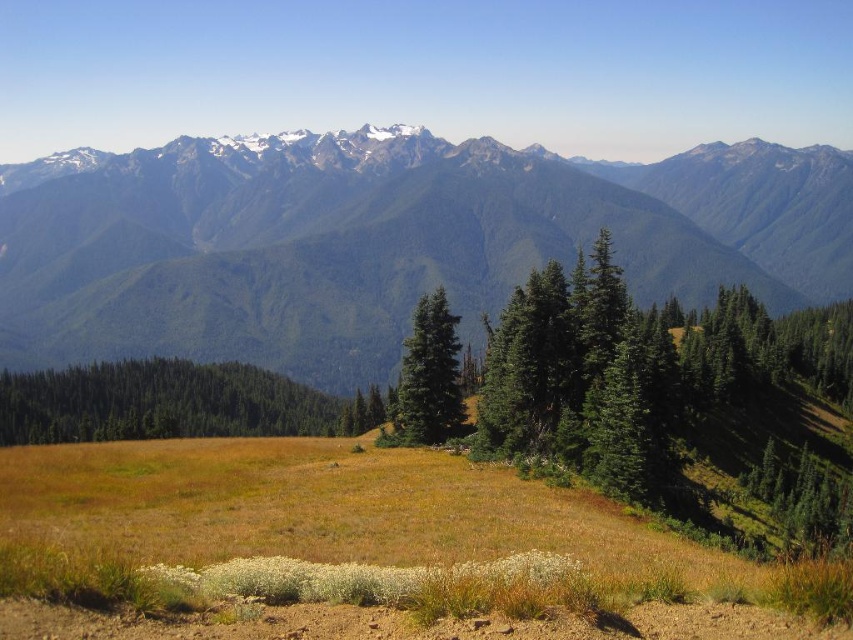
Who is higher up, green forested mountain range at upper center or green matte tree at left?

green forested mountain range at upper center is higher up.

The width and height of the screenshot is (853, 640). What are the coordinates of `green forested mountain range at upper center` in the screenshot? It's located at (383, 240).

Measure the distance between green matte tree at left and green matte tree at center.

They are 52.35 meters apart.

Which of these two, green matte tree at left or green matte tree at center, stands taller?

Standing taller between the two is green matte tree at center.

Measure the distance between point (260, 403) and camera.

The distance of point (260, 403) from camera is 547.31 feet.

Image resolution: width=853 pixels, height=640 pixels. I want to click on green matte tree at left, so pos(169,403).

Is green forested mountain range at upper center taller than green matte tree at center?

Yes, green forested mountain range at upper center is taller than green matte tree at center.

Who is lower down, green forested mountain range at upper center or green matte tree at center?

green matte tree at center is below.

Between point (48, 234) and point (422, 380), which one is positioned behind?

The point (48, 234) is behind.

Find the location of a particular element. This screenshot has width=853, height=640. green forested mountain range at upper center is located at coordinates (383, 240).